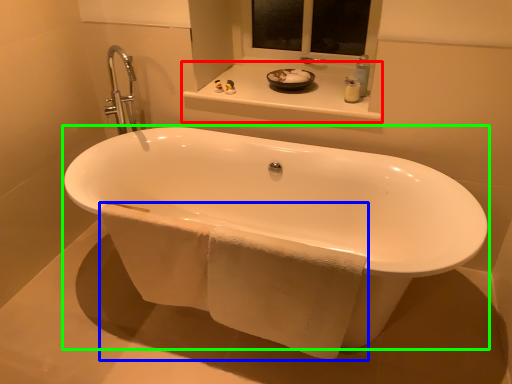
Question: Estimate the real-world distances between objects in this image. Which object is farther from window sill (highlighted by a red box), bath towel (highlighted by a blue box) or bathtub (highlighted by a green box)?

Choices:
 (A) bath towel
 (B) bathtub

Answer: (A)